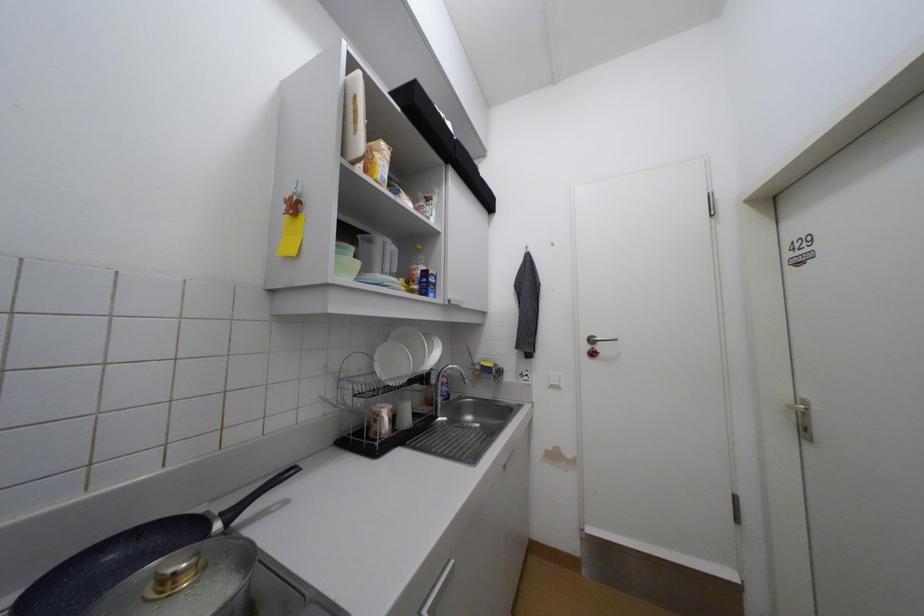
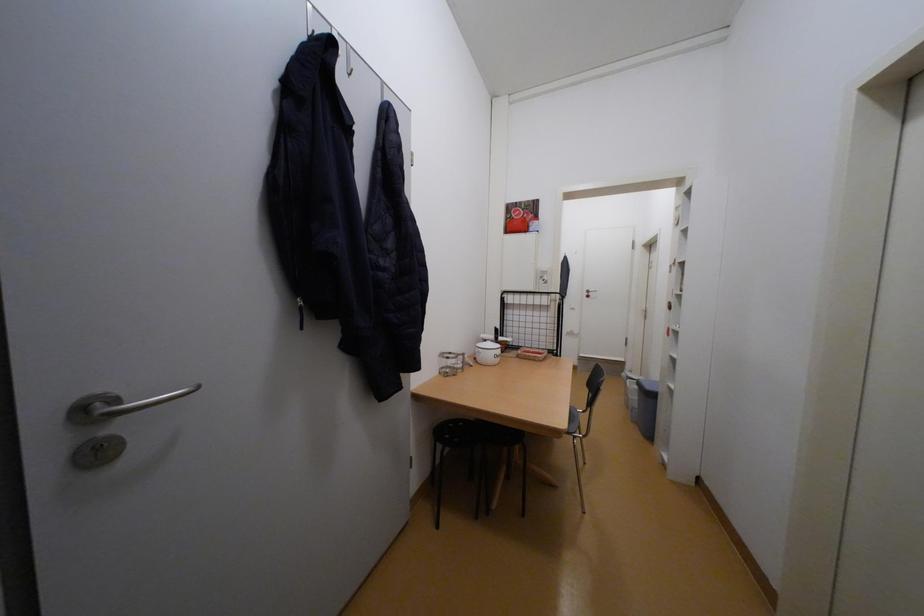
In a continuous first-person perspective shot, in which direction is the camera moving?

The cameraman walked toward left, backward.